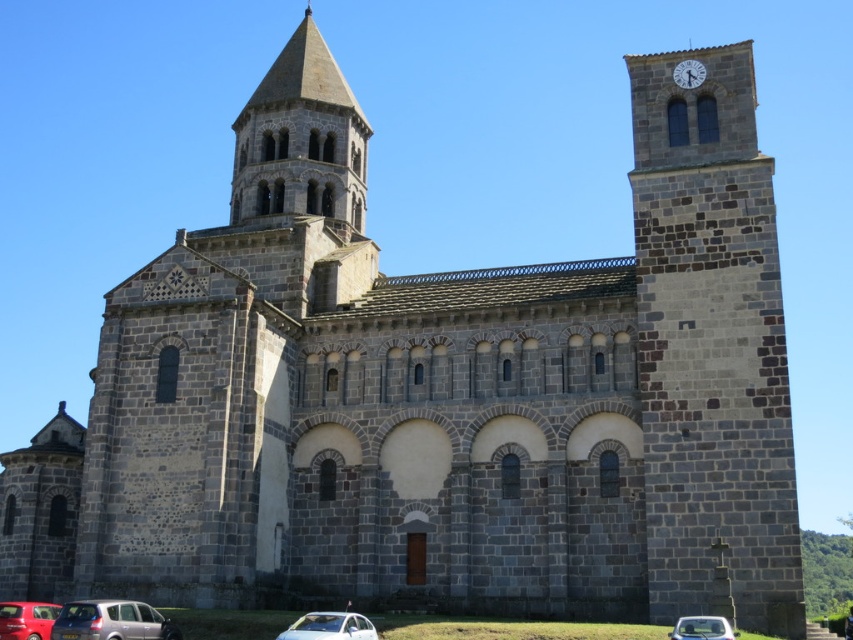
Who is higher up, metallic red car at lower left or white stone clock at upper right?

white stone clock at upper right is higher up.

Can you confirm if metallic red car at lower left is shorter than white stone clock at upper right?

Incorrect, metallic red car at lower left's height does not fall short of white stone clock at upper right's.

Which is behind, point (45, 616) or point (701, 64)?

The point (701, 64) is more distant.

At what (x,y) coordinates should I click in order to perform the action: click on metallic red car at lower left. Please return your answer as a coordinate pair (x, y). Looking at the image, I should click on (26, 620).

Is metallic gray hatchback at lower left thinner than metallic red car at lower left?

Correct, metallic gray hatchback at lower left's width is less than metallic red car at lower left's.

Describe the element at coordinates (111, 621) in the screenshot. Image resolution: width=853 pixels, height=640 pixels. I see `metallic gray hatchback at lower left` at that location.

Locate an element on the screen. The width and height of the screenshot is (853, 640). metallic gray hatchback at lower left is located at coordinates (111, 621).

Does silver metallic car at lower center have a smaller size compared to metallic red car at lower left?

Yes.

Does point (354, 612) lie behind point (25, 609)?

Yes, point (354, 612) is behind point (25, 609).

Does point (318, 618) come closer to viewer compared to point (35, 632)?

Yes, point (318, 618) is in front of point (35, 632).

Where is `silver metallic car at lower center`? This screenshot has height=640, width=853. silver metallic car at lower center is located at coordinates (329, 627).